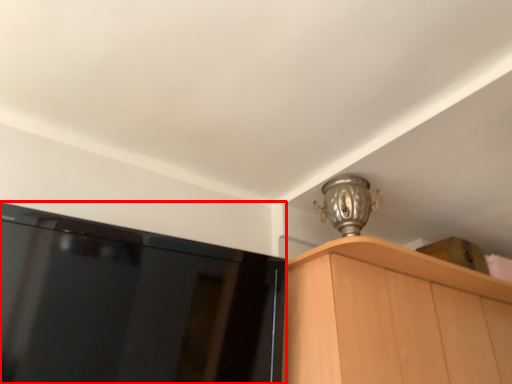
Question: From the image's perspective, what is the correct spatial relationship of screen (annotated by the red box) in relation to cabinetry?

Choices:
 (A) above
 (B) below

Answer: (A)